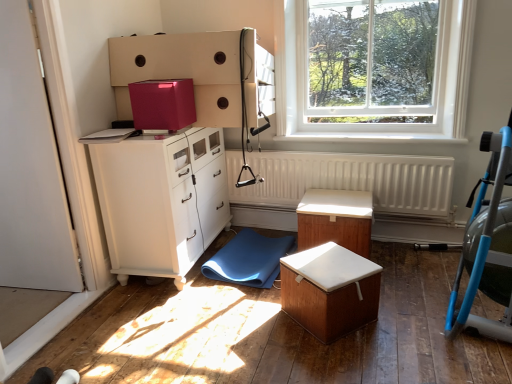
Question: Would you say white matte radiator at center contains wooden box with white cushion at center, marked as the second table in a back-to-front arrangement?

Choices:
 (A) yes
 (B) no

Answer: (B)

Question: Considering the relative sizes of white matte radiator at center and wooden box with white cushion at center, marked as the second table in a back-to-front arrangement, in the image provided, is white matte radiator at center smaller than wooden box with white cushion at center, marked as the second table in a back-to-front arrangement,?

Choices:
 (A) no
 (B) yes

Answer: (A)

Question: Does white matte radiator at center turn towards wooden box with white cushion at center, marked as the first table in a front-to-back arrangement?

Choices:
 (A) no
 (B) yes

Answer: (B)

Question: Is white matte radiator at center at the right side of wooden box with white cushion at center, marked as the first table in a front-to-back arrangement?

Choices:
 (A) no
 (B) yes

Answer: (B)

Question: From the image's perspective, is white matte radiator at center above wooden box with white cushion at center, marked as the second table in a back-to-front arrangement?

Choices:
 (A) no
 (B) yes

Answer: (B)

Question: Is white glossy cabinet at left spatially inside blue rubber mat at lower center, or outside of it?

Choices:
 (A) inside
 (B) outside

Answer: (B)

Question: Is white glossy cabinet at left taller or shorter than blue rubber mat at lower center?

Choices:
 (A) tall
 (B) short

Answer: (A)

Question: Based on their sizes in the image, would you say white glossy cabinet at left is bigger or smaller than blue rubber mat at lower center?

Choices:
 (A) small
 (B) big

Answer: (B)

Question: From a real-world perspective, is white glossy cabinet at left above or below blue rubber mat at lower center?

Choices:
 (A) below
 (B) above

Answer: (B)

Question: Is point pos(296,284) closer or farther from the camera than point pos(370,238)?

Choices:
 (A) closer
 (B) farther

Answer: (A)

Question: Is wooden box with white cushion at center, marked as the second table in a back-to-front arrangement, spatially inside wooden table at center, the 2th table viewed from the front, or outside of it?

Choices:
 (A) inside
 (B) outside

Answer: (B)

Question: Is wooden box with white cushion at center, marked as the first table in a front-to-back arrangement, bigger or smaller than wooden table at center, the 2th table viewed from the front?

Choices:
 (A) small
 (B) big

Answer: (A)

Question: From the image's perspective, is wooden box with white cushion at center, marked as the second table in a back-to-front arrangement, above or below wooden table at center, the 2th table viewed from the front?

Choices:
 (A) below
 (B) above

Answer: (A)

Question: Is blue plastic baby carriage at right to the left or to the right of blue rubber mat at lower center in the image?

Choices:
 (A) right
 (B) left

Answer: (A)

Question: Based on their sizes in the image, would you say blue plastic baby carriage at right is bigger or smaller than blue rubber mat at lower center?

Choices:
 (A) small
 (B) big

Answer: (B)